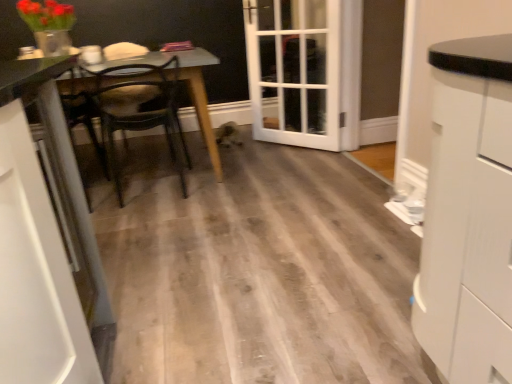
At what (x,y) coordinates should I click in order to perform the action: click on unoccupied space behind white glossy cabinet at left, which ranks as the second cabinetry in right-to-left order. Please return your answer as a coordinate pair (x, y). Image resolution: width=512 pixels, height=384 pixels. Looking at the image, I should click on (138, 306).